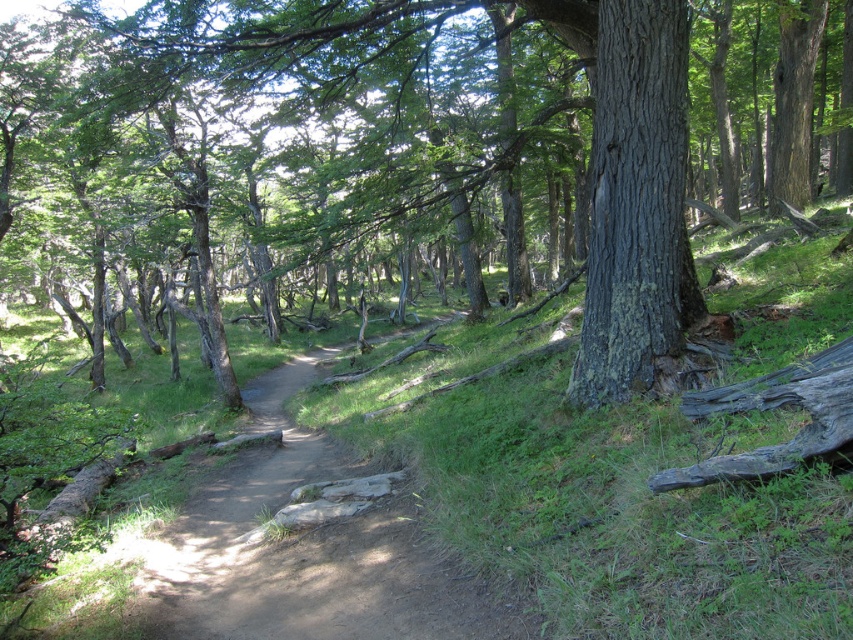
Question: Considering the relative positions of rough bark tree at center and dark gray bark tree at center in the image provided, where is rough bark tree at center located with respect to dark gray bark tree at center?

Choices:
 (A) above
 (B) below

Answer: (A)

Question: Which of the following is the farthest from the observer?

Choices:
 (A) charcoal rough log at right
 (B) dark gray bark tree at center

Answer: (B)

Question: Which point is farther to the camera?

Choices:
 (A) (599, 115)
 (B) (825, 422)

Answer: (A)

Question: Which point is closer to the camera taking this photo?

Choices:
 (A) (680, 236)
 (B) (326, 157)

Answer: (A)

Question: Does rough bark tree at center have a larger size compared to dark gray bark tree at center?

Choices:
 (A) yes
 (B) no

Answer: (A)

Question: Can you confirm if rough bark tree at center is positioned below charcoal rough log at right?

Choices:
 (A) no
 (B) yes

Answer: (A)